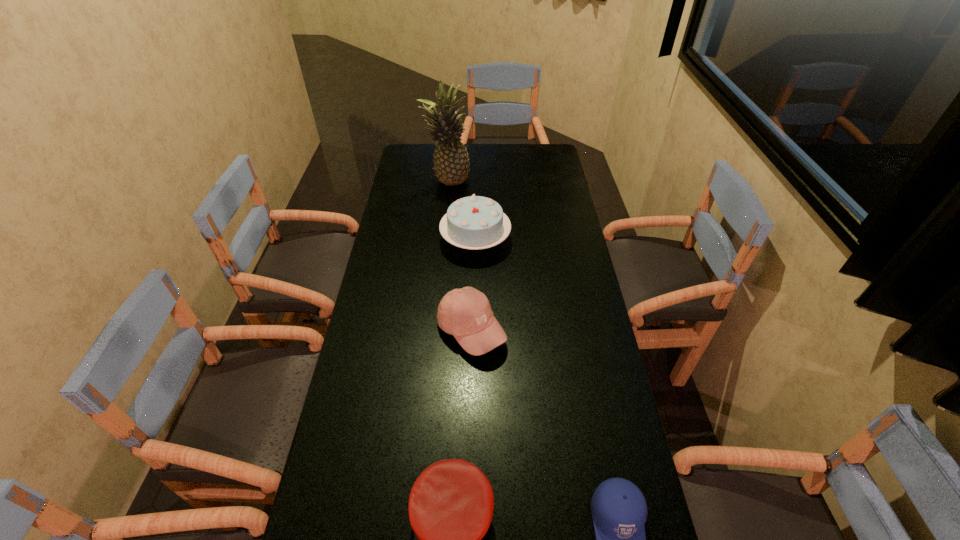
This screenshot has width=960, height=540. In order to click on pineapple in this screenshot , I will do click(x=451, y=161).

Where is `the farthest object`? Image resolution: width=960 pixels, height=540 pixels. the farthest object is located at coordinates (451, 161).

Locate an element on the screen. the fourth shortest object is located at coordinates (475, 222).

You are a GUI agent. You are given a task and a screenshot of the screen. Output one action in this format:
    pyautogui.click(x=<x>, y=<y>)
    Task: Click on the fourth nearest object
    The width and height of the screenshot is (960, 540).
    Given the screenshot: What is the action you would take?
    tap(475, 222)

Find the location of a particular element. This screenshot has height=540, width=960. the third nearest object is located at coordinates (465, 313).

This screenshot has height=540, width=960. In order to click on baseball cap in this screenshot , I will do `click(465, 313)`.

I want to click on vacant space located 0.390m on the right of the tallest object, so click(561, 183).

You are a GUI agent. You are given a task and a screenshot of the screen. Output one action in this format:
    pyautogui.click(x=<x>, y=<y>)
    Task: Click on the free point located on the back of the fourth shortest object
    
    Given the screenshot: What is the action you would take?
    pyautogui.click(x=476, y=186)

The image size is (960, 540). I want to click on blank area located on the front-facing side of the baseball cap, so click(522, 330).

Image resolution: width=960 pixels, height=540 pixels. I want to click on object situated at the far edge, so click(x=451, y=161).